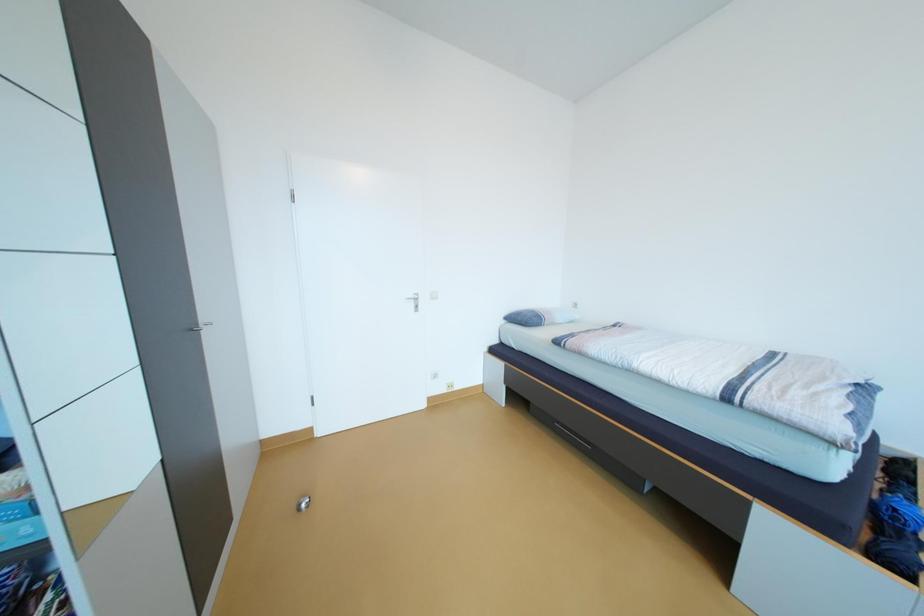
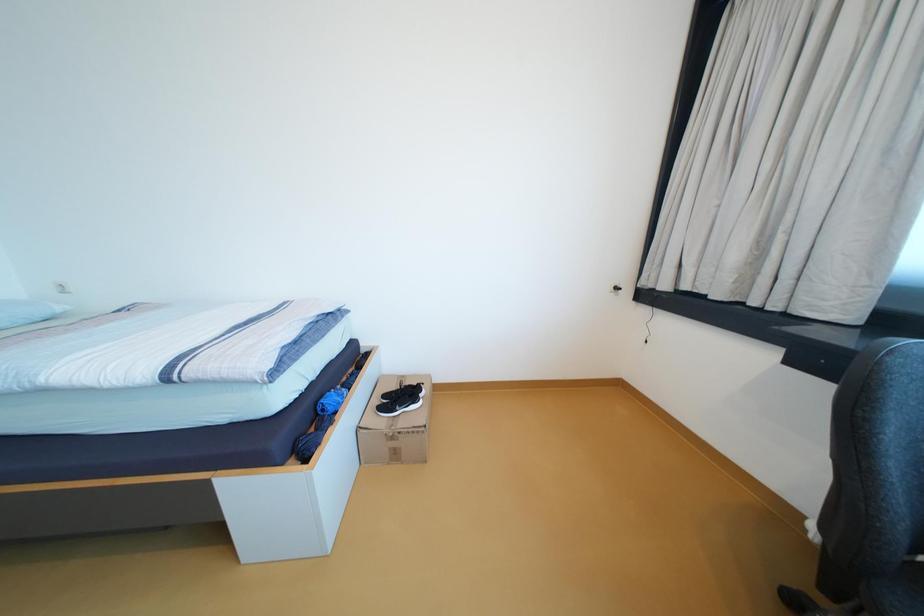
Question: The first image is from the beginning of the video and the second image is from the end. How did the camera likely rotate when shooting the video?

Choices:
 (A) Left
 (B) Right
 (C) Up
 (D) Down

Answer: (B)